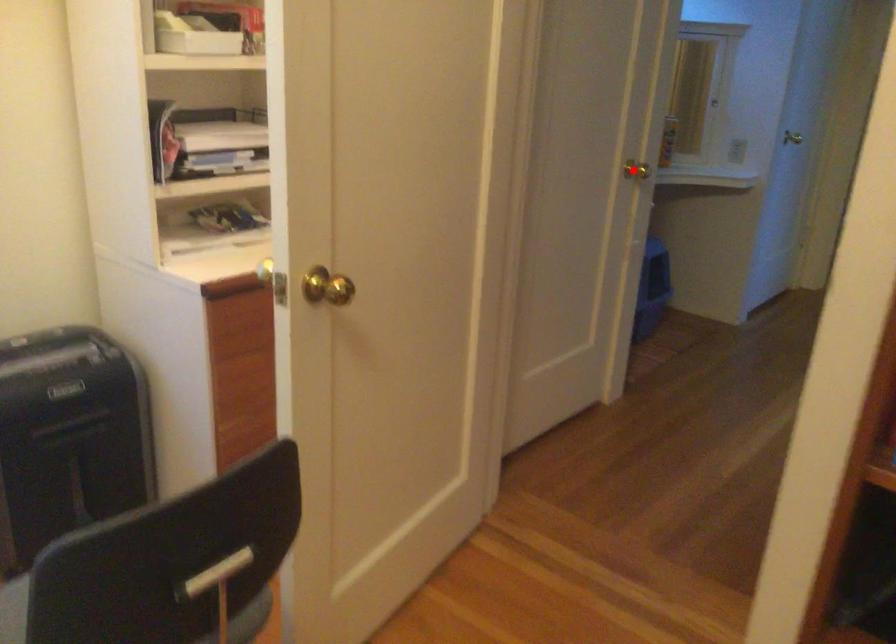
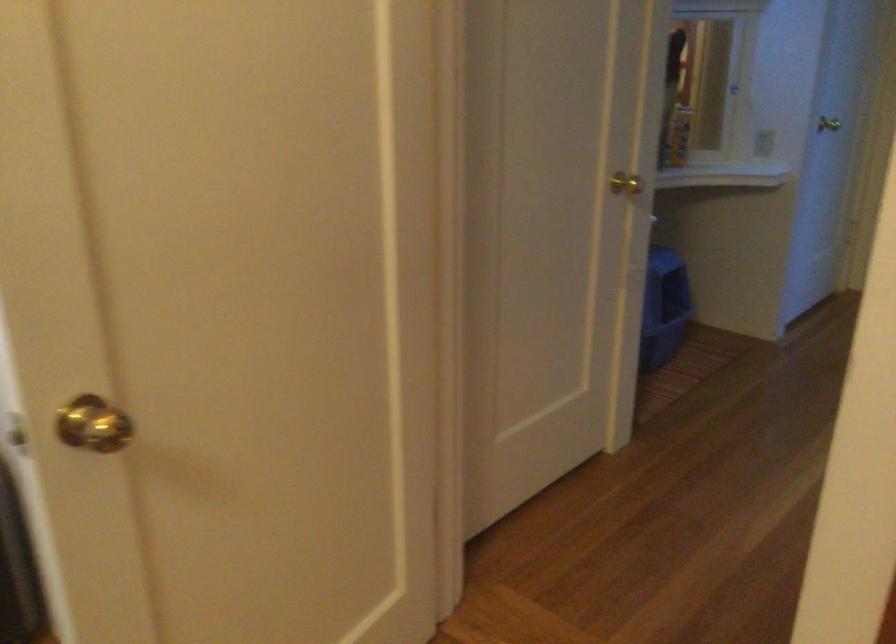
Find the pixel in the second image that matches the highlighted location in the first image.

(625, 184)